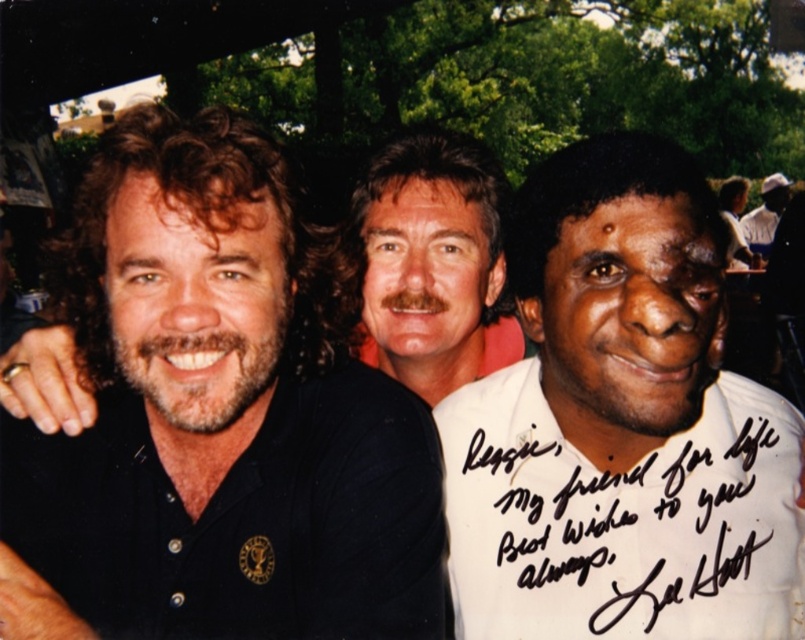
Question: Does black cotton polo shirt at left have a smaller size compared to white paper at right?

Choices:
 (A) no
 (B) yes

Answer: (A)

Question: Which object is positioned farthest from the white paper at right?

Choices:
 (A) black cotton polo shirt at left
 (B) brown hair at center
 (C) white cotton shirt at upper right

Answer: (C)

Question: Where is black cotton polo shirt at left located in relation to brown hair at center in the image?

Choices:
 (A) below
 (B) above

Answer: (A)

Question: Can you confirm if brown hair at center is smaller than white cotton shirt at upper right?

Choices:
 (A) yes
 (B) no

Answer: (A)

Question: Based on their relative distances, which object is nearer to the black cotton polo shirt at left?

Choices:
 (A) white paper at right
 (B) brown hair at center

Answer: (A)

Question: Which object is positioned closest to the brown hair at center?

Choices:
 (A) black cotton polo shirt at left
 (B) white cotton shirt at upper right

Answer: (A)